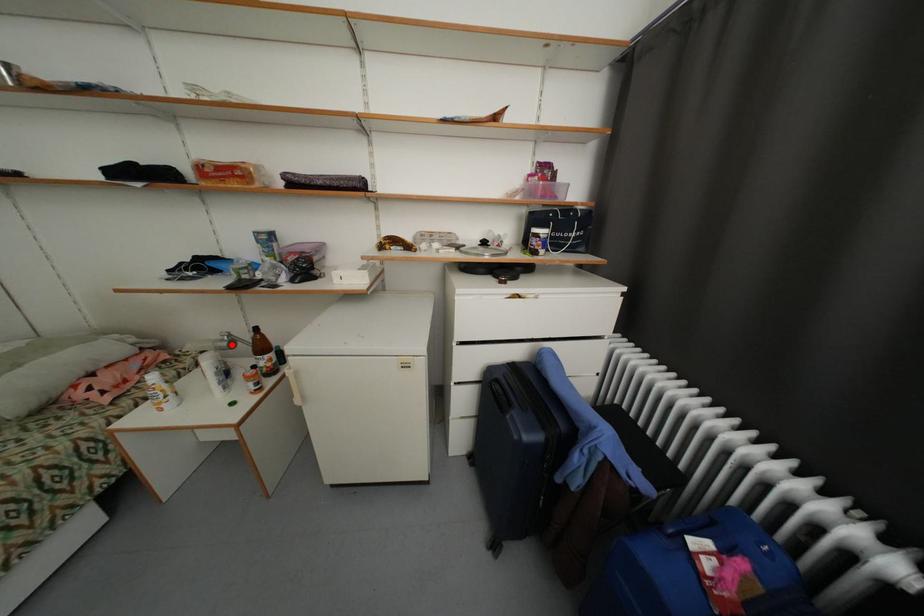
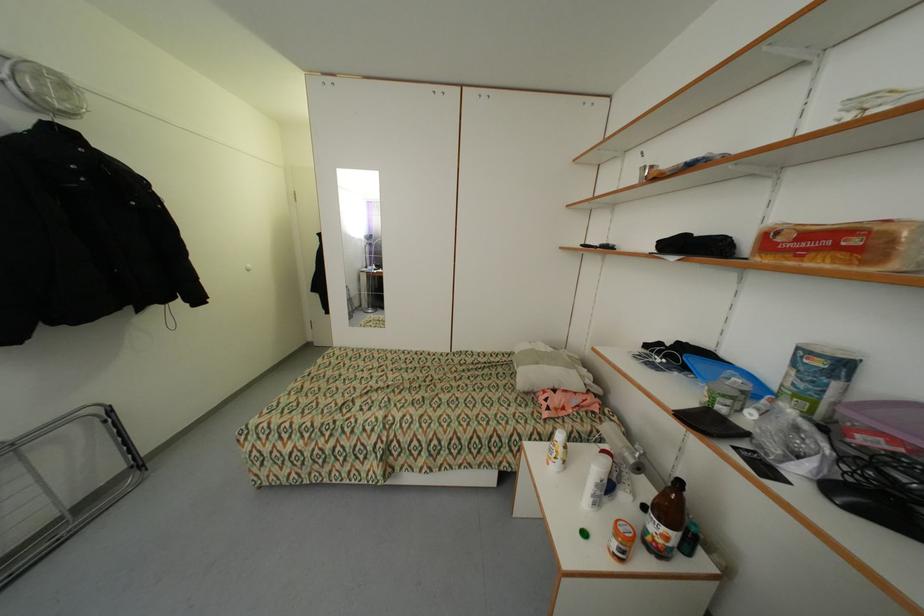
In the second image, find the point that corresponds to the highlighted location in the first image.

(638, 462)